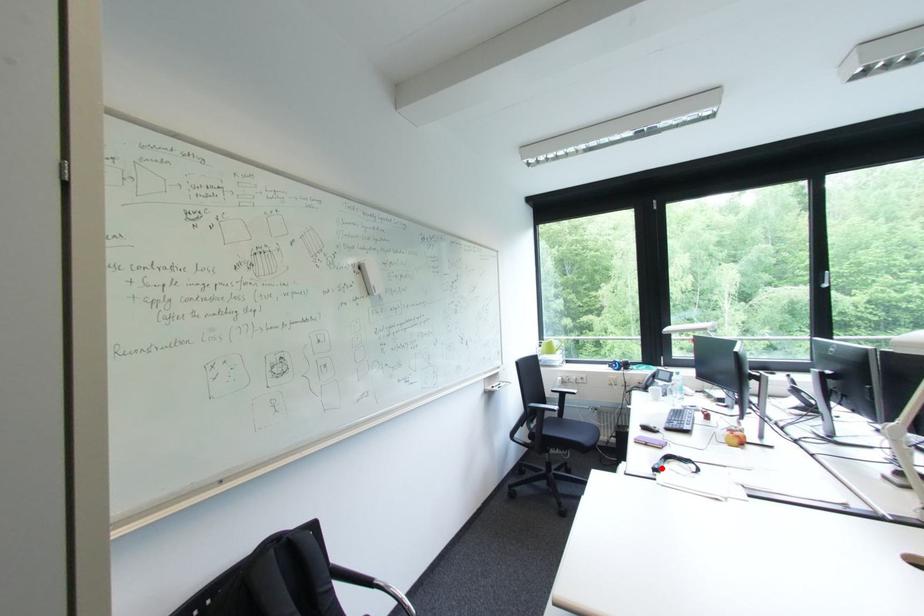
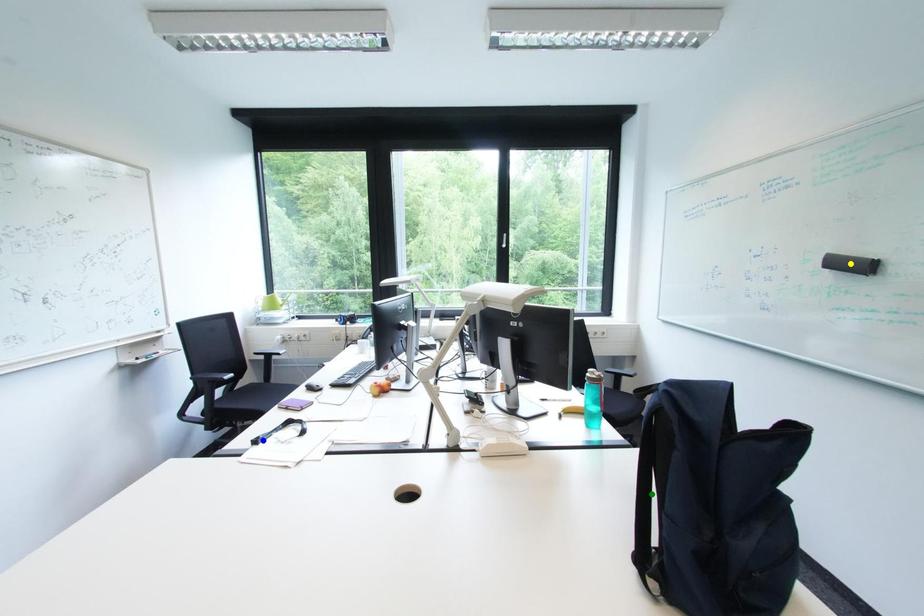
Question: I am providing you with two images of the same scene from different viewpoints. A red point is marked on the first image. You are given multiple points on the second image. Can you choose the point in image 2 that corresponds to the point in image 1?

Choices:
 (A) yellow point
 (B) blue point
 (C) green point

Answer: (B)